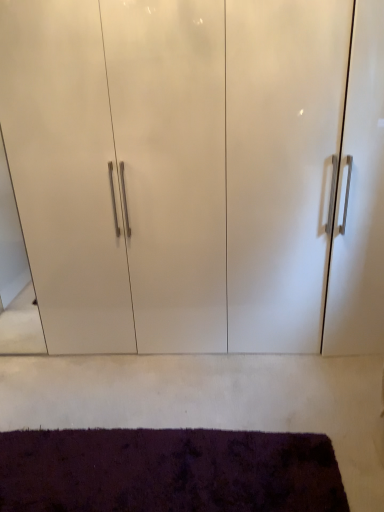
Question: From the image's perspective, relative to white glossy cabinet at center, is dark purple shaggy rug at lower center above or below?

Choices:
 (A) below
 (B) above

Answer: (A)

Question: Considering the positions of dark purple shaggy rug at lower center and white glossy cabinet at center in the image, is dark purple shaggy rug at lower center wider or thinner than white glossy cabinet at center?

Choices:
 (A) wide
 (B) thin

Answer: (B)

Question: In the image, is dark purple shaggy rug at lower center on the left side or the right side of white glossy cabinet at center?

Choices:
 (A) right
 (B) left

Answer: (B)

Question: Considering the positions of white glossy cabinet at center and dark purple shaggy rug at lower center in the image, is white glossy cabinet at center wider or thinner than dark purple shaggy rug at lower center?

Choices:
 (A) thin
 (B) wide

Answer: (B)

Question: Looking at the image, does white glossy cabinet at center seem bigger or smaller compared to dark purple shaggy rug at lower center?

Choices:
 (A) small
 (B) big

Answer: (B)

Question: Is point tap(29, 156) closer or farther from the camera than point tap(43, 468)?

Choices:
 (A) closer
 (B) farther

Answer: (B)

Question: Is white glossy cabinet at center taller or shorter than dark purple shaggy rug at lower center?

Choices:
 (A) tall
 (B) short

Answer: (A)